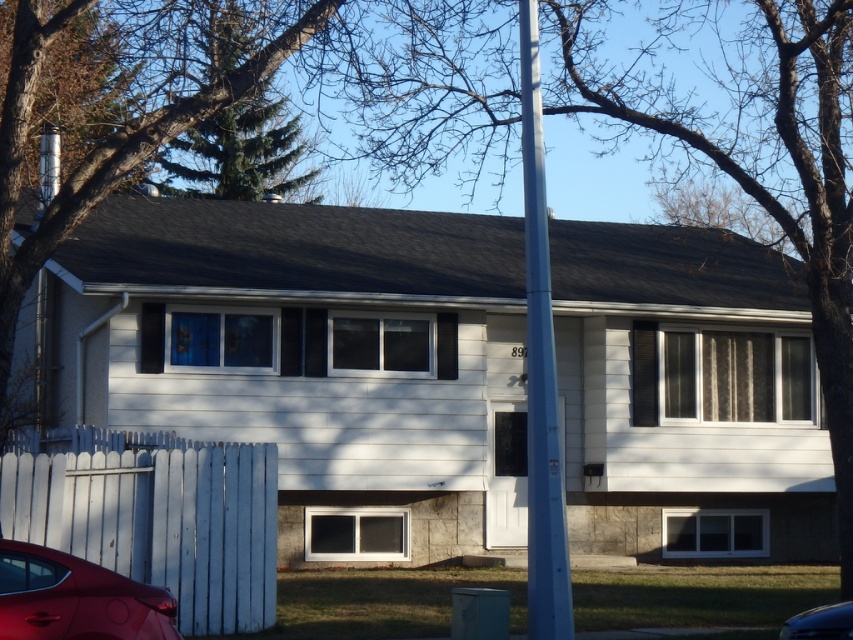
You are a delivery person trying to park your van in the driveway next to the house. You see the white wooden fence at lower left and the shiny red sedan at lower left. Which object takes up more horizontal space in the image?

The white wooden fence at lower left takes up more horizontal space than the shiny red sedan at lower left because its width surpasses the sedan.

You are standing in front of the house and see the point marked at coordinate (540,372). What object is located at that point?

The point at coordinate (540,372) marks the location of the blue metallic pole at center.